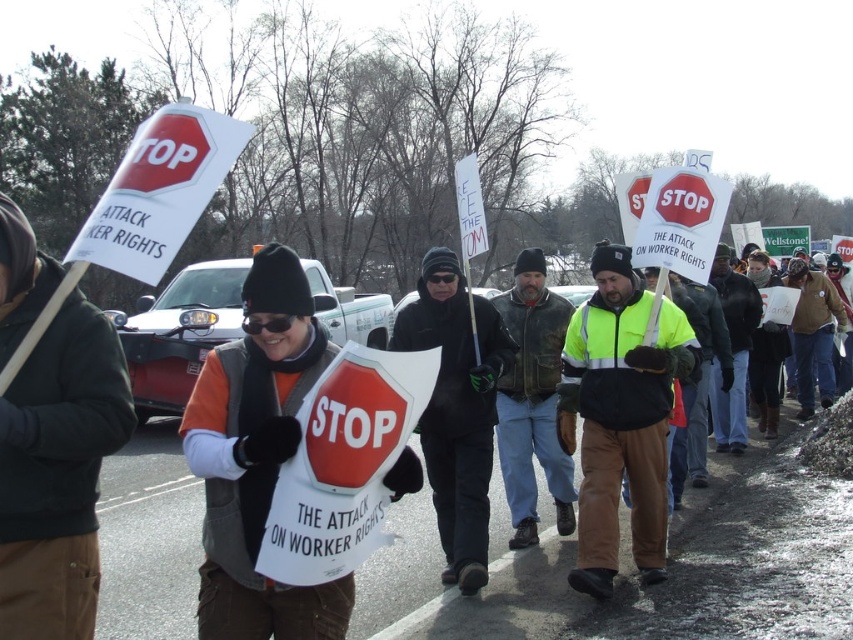
You are a photographer standing at the center of the protest area. You want to take a photo that includes both the point at (258, 429) and the point at (463, 376). Which point should you focus on first to ensure both are in the frame?

You should focus on point (258, 429) first because it is in front of point (463, 376), so by centering your shot on the closer point, you can adjust the frame to include both points.